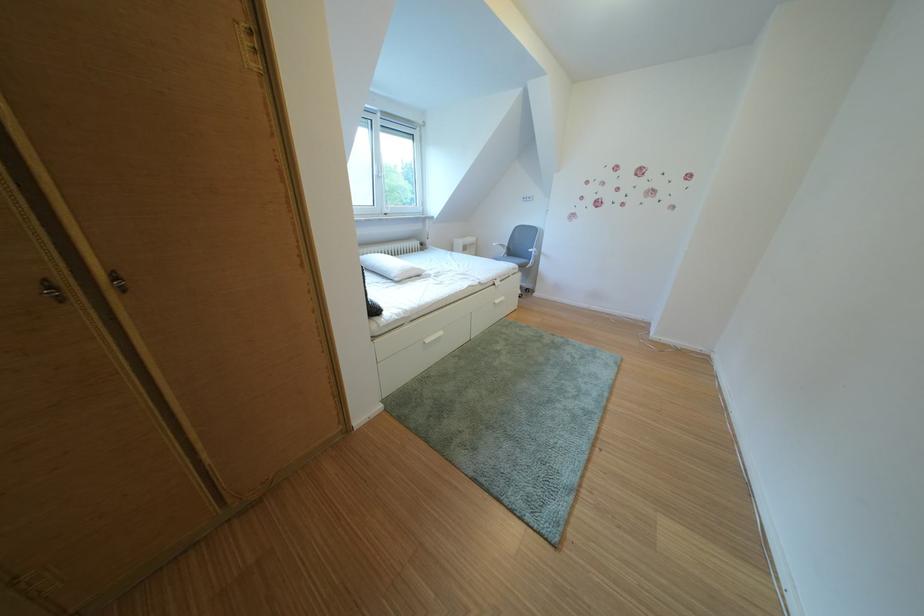
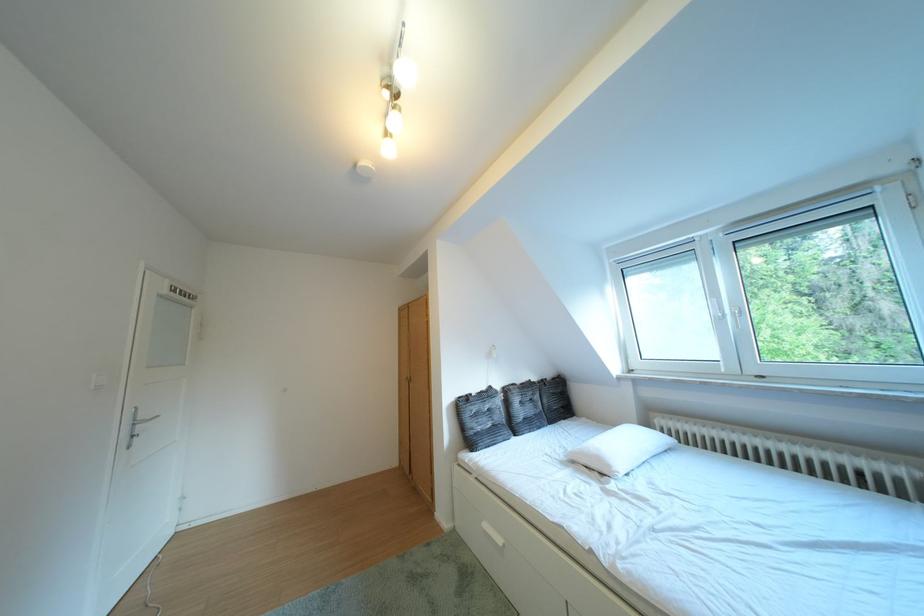
In the second image, find the point that corresponds to the point at 433,275 in the first image.

(623, 471)